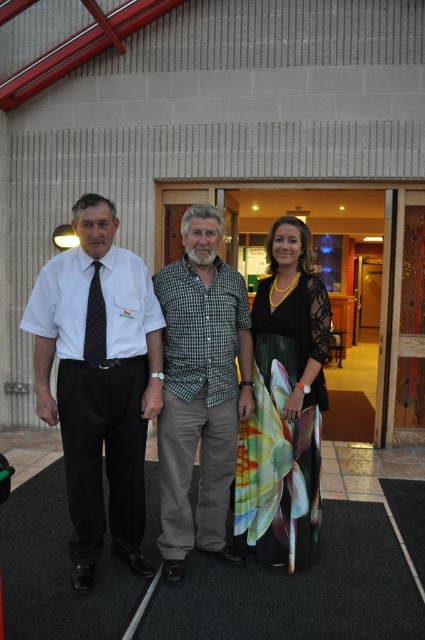
Is point (79, 515) closer to camera compared to point (218, 406)?

Yes.

In the scene shown: Does white shirt at left have a lesser width compared to green checkered shirt at center?

No.

The width and height of the screenshot is (425, 640). What do you see at coordinates (99, 380) in the screenshot?
I see `white shirt at left` at bounding box center [99, 380].

Where is `white shirt at left`? The image size is (425, 640). white shirt at left is located at coordinates (99, 380).

Which is behind, point (166, 564) or point (311, 451)?

The point (311, 451) is behind.

Locate an element on the screen. The height and width of the screenshot is (640, 425). green checkered shirt at center is located at coordinates (200, 388).

Does white shirt at left appear over floral silk dress at center?

Indeed, white shirt at left is positioned over floral silk dress at center.

This screenshot has height=640, width=425. Describe the element at coordinates (99, 380) in the screenshot. I see `white shirt at left` at that location.

At what (x,y) coordinates should I click in order to perform the action: click on white shirt at left. Please return your answer as a coordinate pair (x, y). The height and width of the screenshot is (640, 425). Looking at the image, I should click on [99, 380].